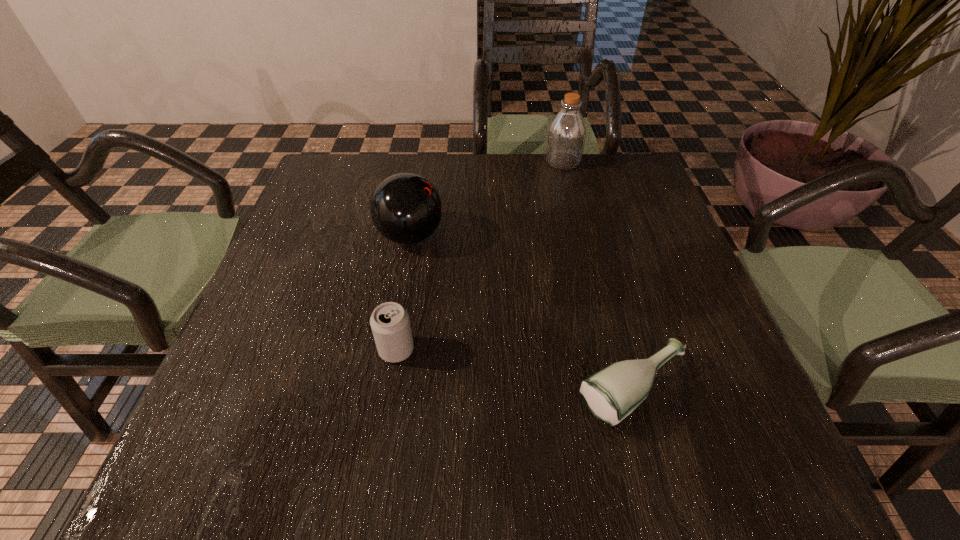
Image resolution: width=960 pixels, height=540 pixels. What are the coordinates of `the tallest object` in the screenshot? It's located at (566, 136).

Find the location of `the farthest object`. the farthest object is located at coordinates (566, 136).

Where is `the second tallest object`? Image resolution: width=960 pixels, height=540 pixels. the second tallest object is located at coordinates (405, 208).

The height and width of the screenshot is (540, 960). Find the location of `bowling ball`. bowling ball is located at coordinates (405, 208).

Where is `the second shortest object`? This screenshot has width=960, height=540. the second shortest object is located at coordinates (390, 324).

At what (x,y) coordinates should I click in order to perform the action: click on the shorter bottle. Please return your answer as a coordinate pair (x, y). Looking at the image, I should click on (611, 394).

Identify the location of the shortest object. (611, 394).

Identify the location of vacant space located 0.210m on the front of the tallest object. The width and height of the screenshot is (960, 540). (576, 219).

Where is `free space located 0.200m on the surface of the second tallest object near the finger holes`? free space located 0.200m on the surface of the second tallest object near the finger holes is located at coordinates (529, 236).

Where is `free region located on the front of the third tallest object`? Image resolution: width=960 pixels, height=540 pixels. free region located on the front of the third tallest object is located at coordinates (378, 467).